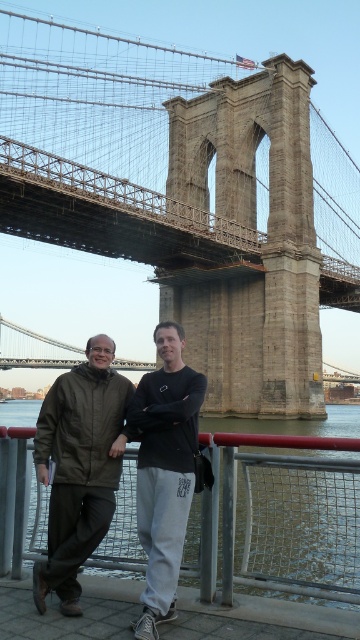
You are standing on the walkway near the Brooklyn Bridge and want to take a photo of both the point at coordinates (104, 100) and the point at coordinates (186, 428). Since you can only focus on one point at a time, which point should you focus on first to ensure the other is still in the frame?

You should focus on point (186, 428) first because point (104, 100) is behind it, so if you focus on the closer point first, the farther one will still be in the frame.